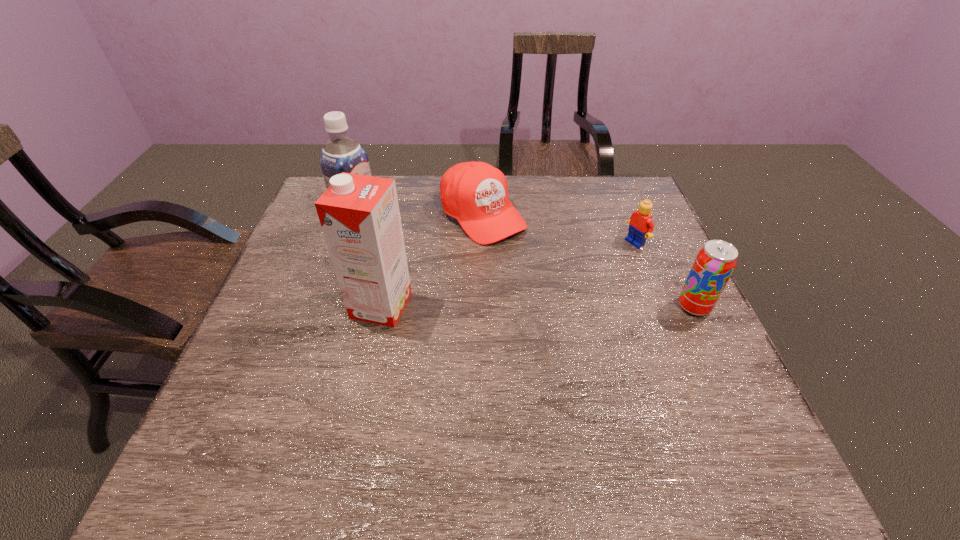
The width and height of the screenshot is (960, 540). I want to click on vacant point located on the label of the soya milk, so click(491, 289).

Image resolution: width=960 pixels, height=540 pixels. I want to click on vacant space located on the front panel of the baseball cap, so click(x=520, y=253).

You are a GUI agent. You are given a task and a screenshot of the screen. Output one action in this format:
    pyautogui.click(x=<x>, y=<y>)
    Task: Click on the free space located on the front panel of the baseball cap
    
    Given the screenshot: What is the action you would take?
    click(x=520, y=253)

Where is `vacant space located on the front panel of the baseball cap`? The height and width of the screenshot is (540, 960). vacant space located on the front panel of the baseball cap is located at coordinates (604, 330).

At what (x,y) coordinates should I click in order to perform the action: click on vacant space situated 0.140m on the face of the Lego. Please return your answer as a coordinate pair (x, y). Looking at the image, I should click on (590, 267).

You are a GUI agent. You are given a task and a screenshot of the screen. Output one action in this format:
    pyautogui.click(x=<x>, y=<y>)
    Task: Click on the vacant region located on the face of the Lego
    Image resolution: width=960 pixels, height=540 pixels.
    Given the screenshot: What is the action you would take?
    pyautogui.click(x=544, y=291)

In order to click on vacant space situated 0.340m on the face of the Lego in this screenshot , I will do `click(532, 298)`.

The width and height of the screenshot is (960, 540). I want to click on soya milk at the far edge, so click(x=340, y=154).

What are the coordinates of `baseball cap positioned at the far edge` in the screenshot? It's located at (475, 193).

You are a GUI agent. You are given a task and a screenshot of the screen. Output one action in this format:
    pyautogui.click(x=<x>, y=<y>)
    Task: Click on the object that is positioned at the left edge
    This screenshot has width=960, height=540.
    Given the screenshot: What is the action you would take?
    pyautogui.click(x=340, y=154)